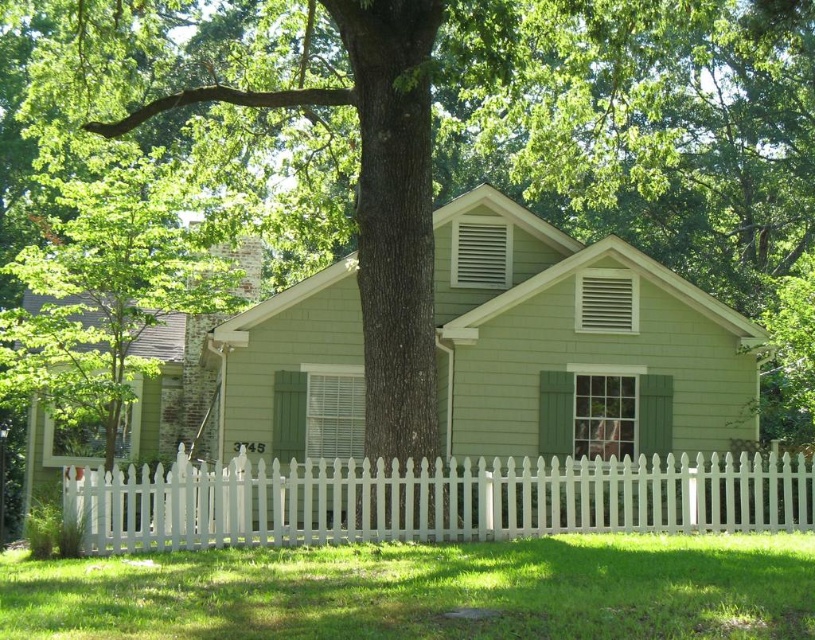
You are a window cleaner who needs to reach both the green painted wood shutter at center and the white matte vent at upper center. Which one should you clean first if you start from the ground and move upwards?

The green painted wood shutter at center is located below the white matte vent at upper center, so you should clean the green painted wood shutter at center first before moving upwards to the white matte vent at upper center.

You are standing in front of the house and want to touch both the green painted wood shutter at center and the white matte vent at upper center. Which one can you reach without moving your position?

The green painted wood shutter at center is closer to the viewer than the white matte vent at upper center, so you can reach the green painted wood shutter at center without moving your position.

You are a painter who needs to decide which object to paint first between the white picket fence at lower center and the green matte shutter at upper right. If you prioritize painting the larger object first, which one should you choose?

The white picket fence at lower center has a larger size compared to the green matte shutter at upper right, so you should paint the white picket fence at lower center first.